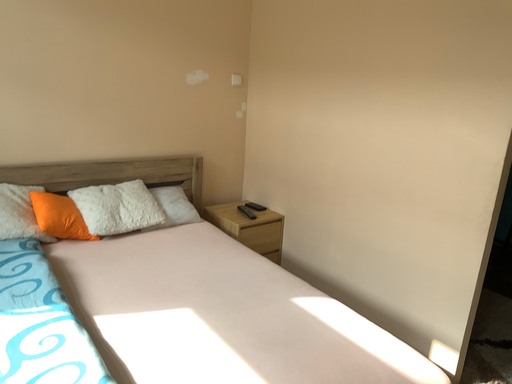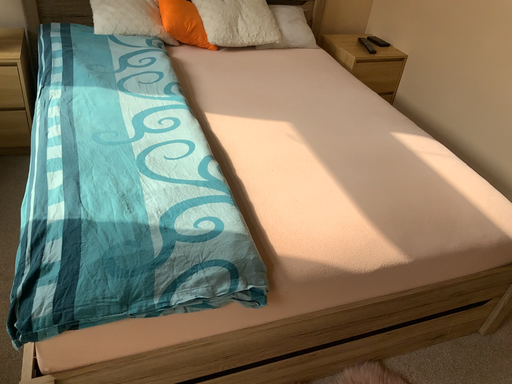
Question: Which way did the camera rotate in the video?

Choices:
 (A) rotated upward
 (B) rotated downward

Answer: (B)